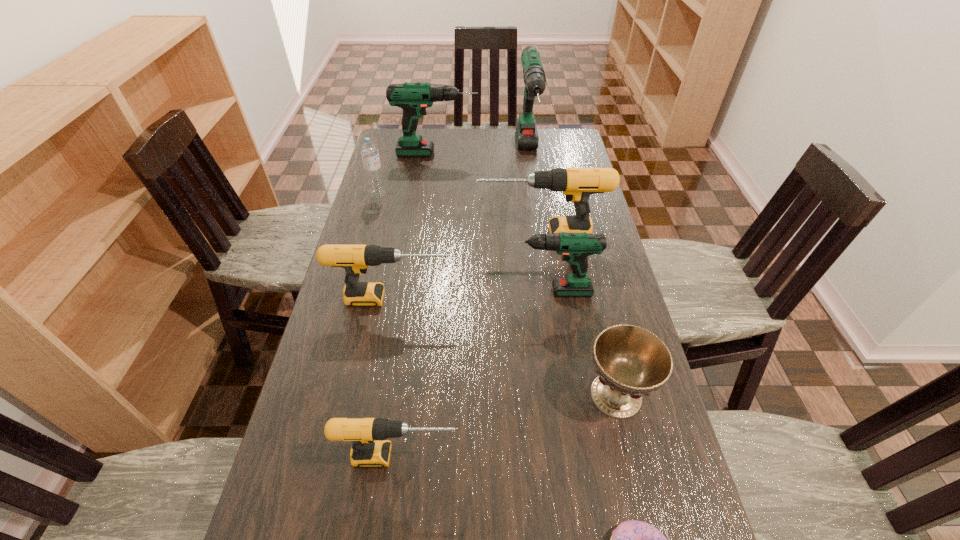
The height and width of the screenshot is (540, 960). What are the coordinates of `vacant space that is in between the fourth farthest object and the water bottle` in the screenshot? It's located at (459, 214).

The image size is (960, 540). I want to click on empty space that is in between the water bottle and the nearest green drill, so click(464, 243).

The width and height of the screenshot is (960, 540). Find the location of `vacant space in between the chalice and the shortest drill`. vacant space in between the chalice and the shortest drill is located at coordinates (507, 426).

What are the coordinates of `free space between the tallest drill and the leftmost green drill` in the screenshot? It's located at point(483,154).

Image resolution: width=960 pixels, height=540 pixels. What are the coordinates of `free space between the second biggest black drill and the seventh nearest object` in the screenshot? It's located at (385, 246).

You are a GUI agent. You are given a task and a screenshot of the screen. Output one action in this format:
    pyautogui.click(x=<x>, y=<y>)
    Task: Click on the second closest object relative to the rightmost black drill
    The height and width of the screenshot is (540, 960).
    Given the screenshot: What is the action you would take?
    pyautogui.click(x=355, y=259)

Where is `object that stands as the eighth closest to the rightmost black drill`? This screenshot has width=960, height=540. object that stands as the eighth closest to the rightmost black drill is located at coordinates (632, 539).

Select which drill is the fifth closest to the second smallest black drill. Please provide its 2D coordinates. Your answer should be formatted as a tuple, i.e. [(x, y)], where the tuple contains the x and y coordinates of a point satisfying the conditions above.

[(414, 98)]

Locate which drill ranks third in proximity to the smallest black drill. Please provide its 2D coordinates. Your answer should be formatted as a tuple, i.e. [(x, y)], where the tuple contains the x and y coordinates of a point satisfying the conditions above.

[(577, 184)]

Locate which green drill is the second closest to the third farthest object. Please provide its 2D coordinates. Your answer should be formatted as a tuple, i.e. [(x, y)], where the tuple contains the x and y coordinates of a point satisfying the conditions above.

[(534, 76)]